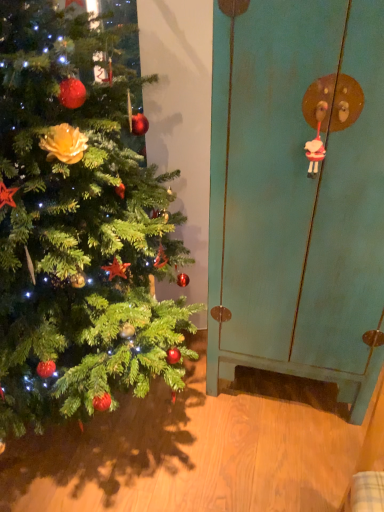
Question: From a real-world perspective, is green matte christmas tree at left physically located above or below white glossy sheep at upper right?

Choices:
 (A) above
 (B) below

Answer: (B)

Question: Is green matte christmas tree at left to the left or to the right of white glossy sheep at upper right in the image?

Choices:
 (A) left
 (B) right

Answer: (A)

Question: Estimate the real-world distances between objects in this image. Which object is farther from the green matte christmas tree at left?

Choices:
 (A) white glossy sheep at upper right
 (B) teal matte cabinet at right

Answer: (A)

Question: Which of these objects is positioned closest to the teal matte cabinet at right?

Choices:
 (A) white glossy sheep at upper right
 (B) green matte christmas tree at left

Answer: (A)